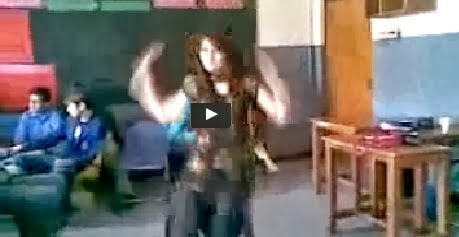
The height and width of the screenshot is (237, 459). Identify the location of door. (338, 70).